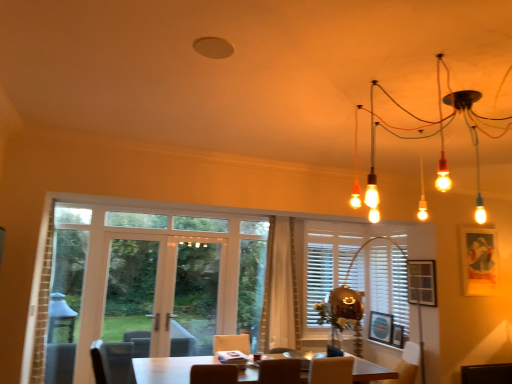
Locate an element on the screen. This screenshot has height=384, width=512. vacant space situated above wooden screen door at left, positioned as the 1th screen door in left-to-right order (from a real-world perspective) is located at coordinates (144, 226).